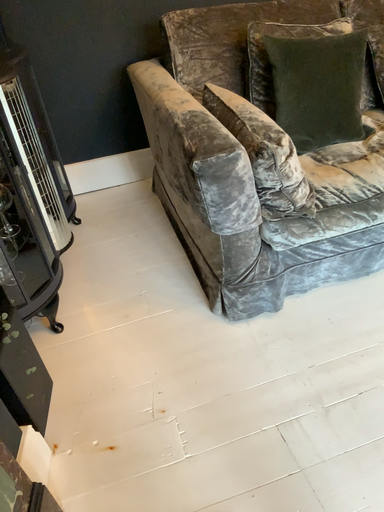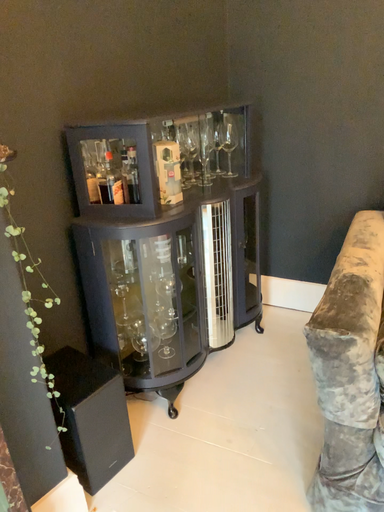
Question: How did the camera likely rotate when shooting the video?

Choices:
 (A) rotated right
 (B) rotated left

Answer: (B)